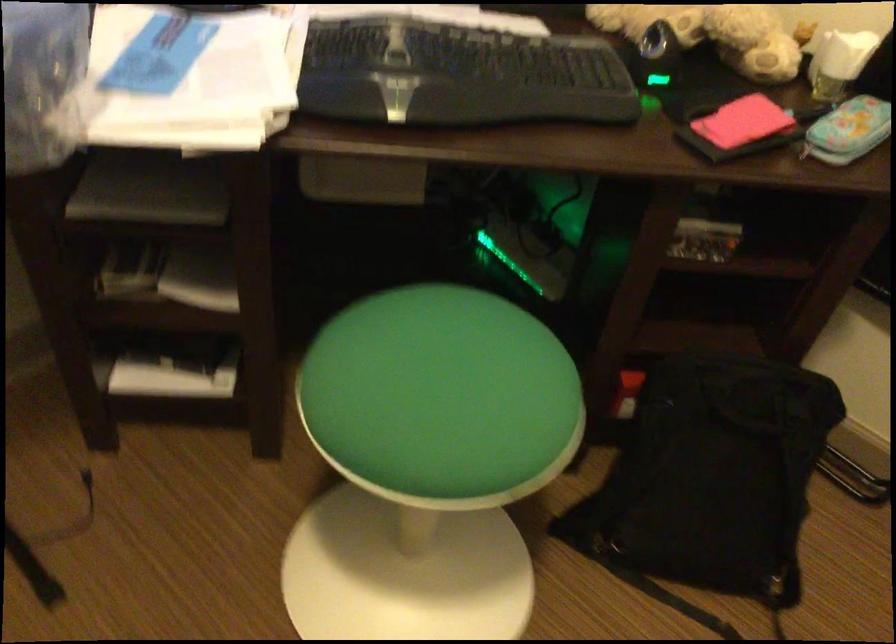
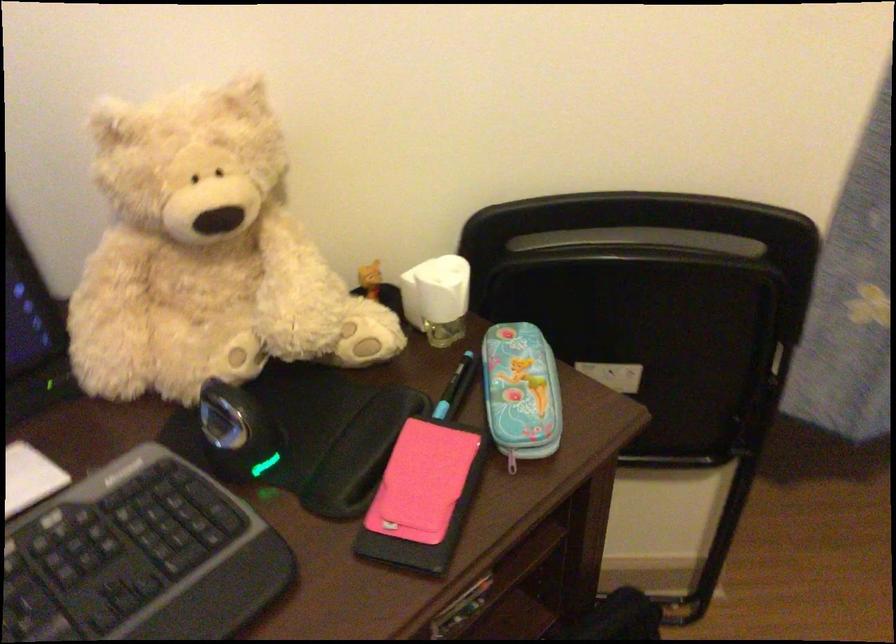
Find the pixel in the second image that matches pixel 800 106 in the first image.

(455, 389)